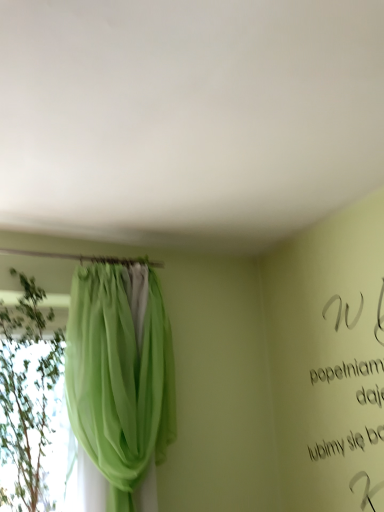
Question: In terms of height, does green sheer curtain at left look taller or shorter compared to green sheer curtain at left?

Choices:
 (A) tall
 (B) short

Answer: (B)

Question: In terms of size, does green sheer curtain at left appear bigger or smaller than green sheer curtain at left?

Choices:
 (A) small
 (B) big

Answer: (A)

Question: Is green sheer curtain at left wider or thinner than green sheer curtain at left?

Choices:
 (A) wide
 (B) thin

Answer: (A)

Question: Considering the positions of green sheer curtain at left and green sheer curtain at left in the image, is green sheer curtain at left taller or shorter than green sheer curtain at left?

Choices:
 (A) tall
 (B) short

Answer: (A)

Question: In terms of size, does green sheer curtain at left appear bigger or smaller than green sheer curtain at left?

Choices:
 (A) big
 (B) small

Answer: (A)

Question: Looking at their shapes, would you say green sheer curtain at left is wider or thinner than green sheer curtain at left?

Choices:
 (A) thin
 (B) wide

Answer: (A)

Question: Would you say green sheer curtain at left is to the left or to the right of green sheer curtain at left in the picture?

Choices:
 (A) left
 (B) right

Answer: (B)